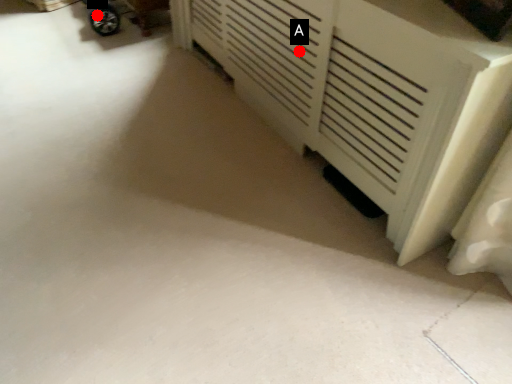
Question: Two points are circled on the image, labeled by A and B beside each circle. Which point is further to the camera?

Choices:
 (A) A is further
 (B) B is further

Answer: (B)